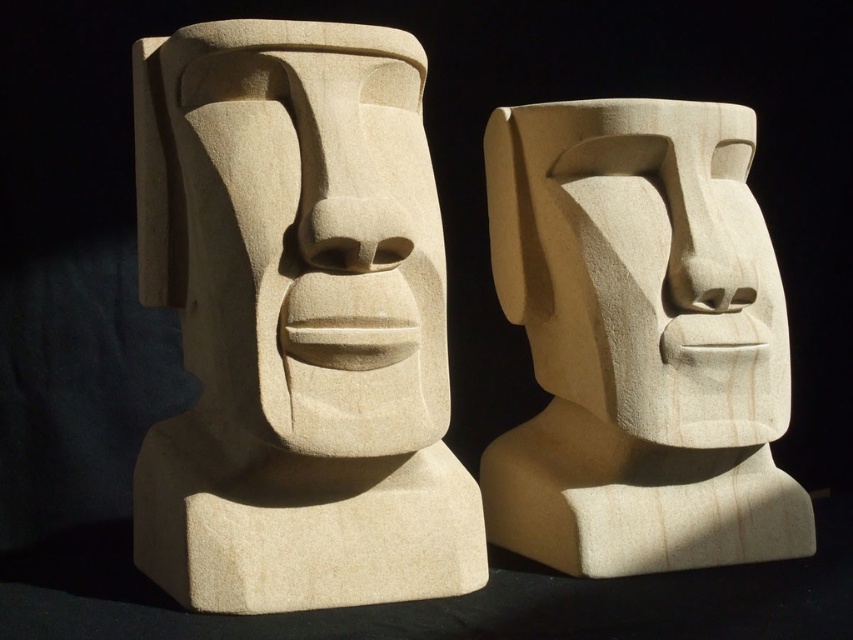
You are an art curator arranging an exhibition. You have two sculptures in front of you, the smooth beige stone moai head at center and the smooth beige stone head at center. Which sculpture is closer to the front of the display?

The smooth beige stone moai head at center is closer to the front of the display because it is positioned in front of the smooth beige stone head at center.

You are an art conservator examining the image of two stone sculptures. You notice a point marked at coordinates (297,323). Based on the scene description, what does this point correspond to?

The point at coordinates (297,323) marks the smooth beige stone moai head at center.

You are an art curator examining two stone sculptures in a gallery. You notice the smooth beige stone moai head at center and the smooth beige stone head at center. Which of these two sculptures is positioned higher up in the image?

The smooth beige stone moai head at center is positioned higher up in the image compared to the smooth beige stone head at center, as it is located above it.